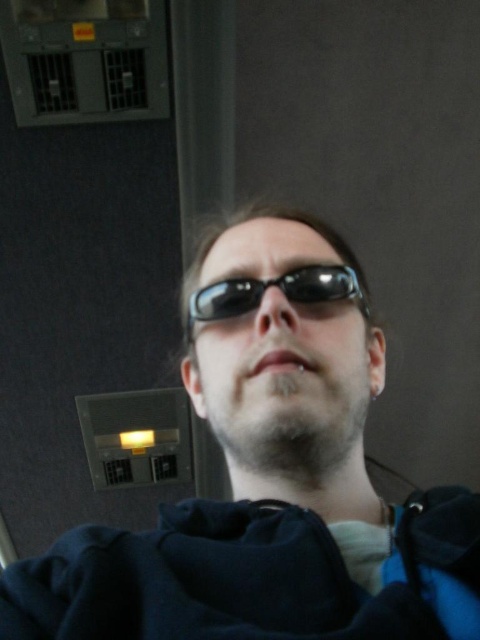
Is point (215, 422) positioned before point (192, 310)?

Yes.

Where is `matte black sunglasses at center`? This screenshot has height=640, width=480. matte black sunglasses at center is located at coordinates (269, 477).

The height and width of the screenshot is (640, 480). I want to click on matte black sunglasses at center, so click(269, 477).